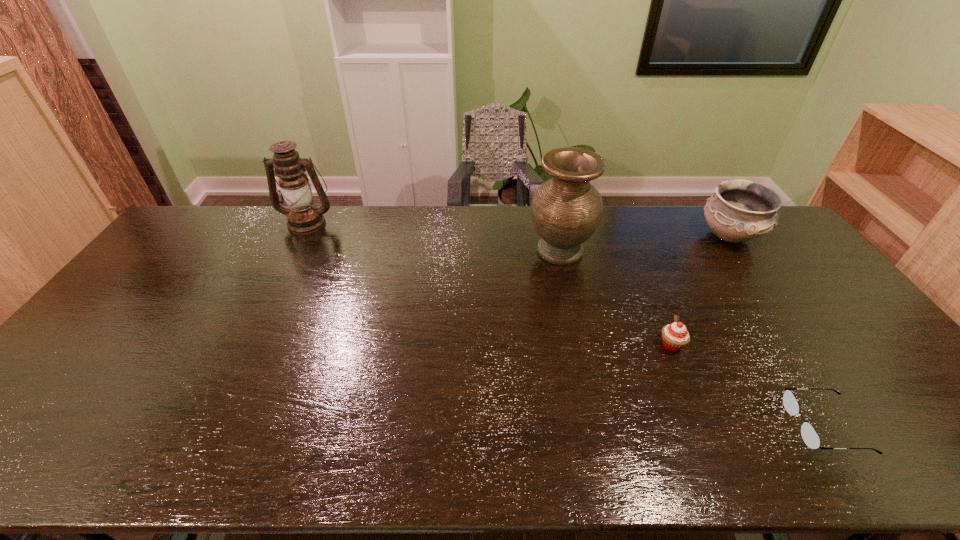
Locate an element on the screen. The width and height of the screenshot is (960, 540). vacant position at the far edge of the desktop is located at coordinates (252, 238).

In the image, there is a desktop. Where is `free region at the near edge`? Image resolution: width=960 pixels, height=540 pixels. free region at the near edge is located at coordinates (853, 433).

I want to click on free space at the left edge, so click(142, 273).

In order to click on vacant space that is in between the leftmost object and the second object from left to right in this screenshot , I will do `click(434, 237)`.

Locate an element on the screen. This screenshot has height=540, width=960. vacant space that's between the fourth object from right to left and the cupcake is located at coordinates (615, 298).

The width and height of the screenshot is (960, 540). I want to click on vacant space that is in between the fourth tallest object and the vase, so click(615, 298).

Identify the location of empty space that is in between the third shortest object and the fourth object from right to left. [x=645, y=244].

Where is `vacant area between the second shortest object and the leftmost object`? The image size is (960, 540). vacant area between the second shortest object and the leftmost object is located at coordinates (490, 284).

Where is `free space between the third tallest object and the leftmost object`? Image resolution: width=960 pixels, height=540 pixels. free space between the third tallest object and the leftmost object is located at coordinates (518, 229).

This screenshot has width=960, height=540. I want to click on free point between the pottery and the second nearest object, so click(x=701, y=291).